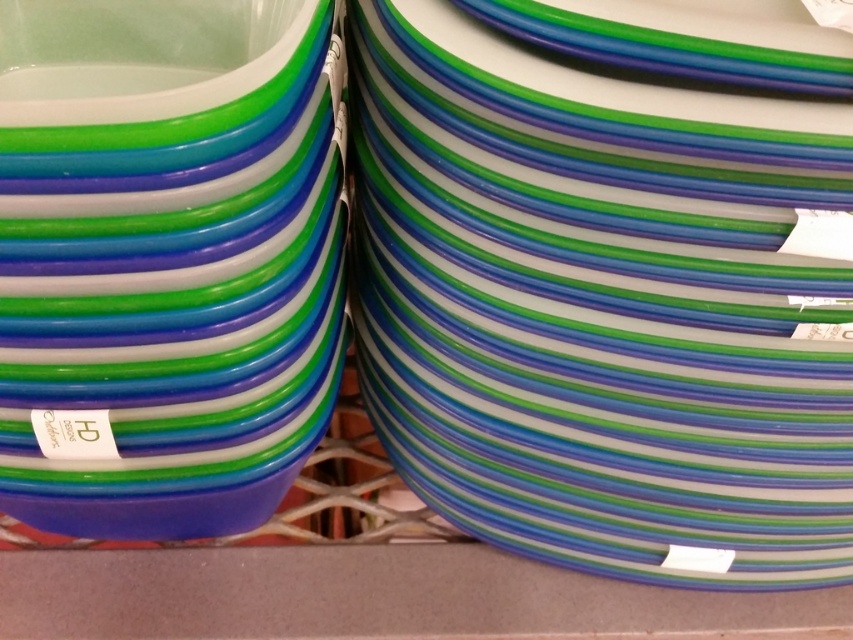
Find the location of `matte plastic plate at center`. matte plastic plate at center is located at coordinates (605, 307).

Based on the photo, is matte plastic plate at center closer to the viewer compared to matte plastic plate at left?

No, it is not.

Does point (401, 22) lie in front of point (223, 396)?

That is True.

The height and width of the screenshot is (640, 853). Find the location of `matte plastic plate at center`. matte plastic plate at center is located at coordinates click(x=605, y=307).